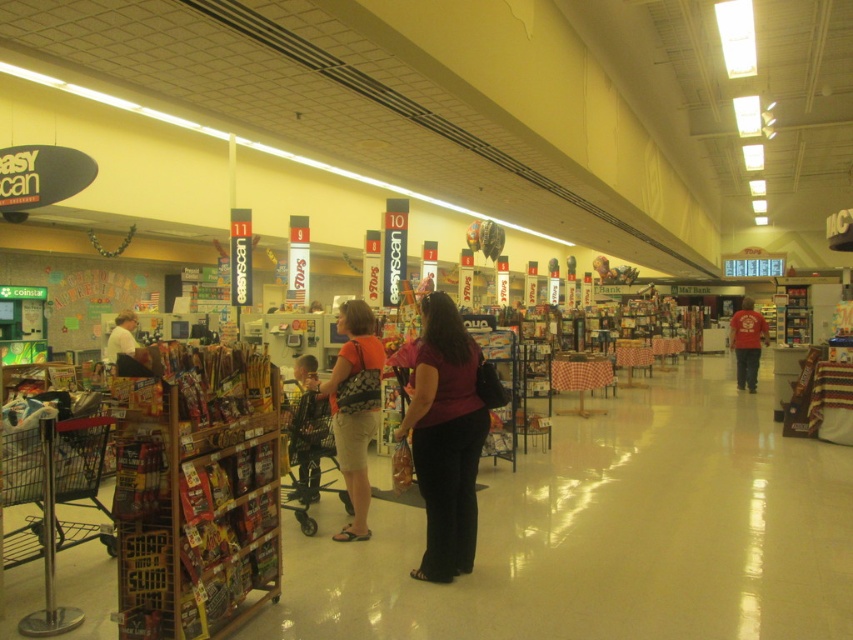
Is point (355, 422) positioned before point (747, 376)?

Yes, point (355, 422) is closer to viewer.

Who is more forward, [364,500] or [741,305]?

Point [364,500]

The height and width of the screenshot is (640, 853). Find the location of `orange fabric purse at center`. orange fabric purse at center is located at coordinates (354, 412).

Between silver metallic shopping cart at lower left and red cotton shirt at right, which one has more height?

Standing taller between the two is red cotton shirt at right.

Does silver metallic shopping cart at lower left appear on the left side of red cotton shirt at right?

Indeed, silver metallic shopping cart at lower left is positioned on the left side of red cotton shirt at right.

The height and width of the screenshot is (640, 853). Describe the element at coordinates (83, 516) in the screenshot. I see `silver metallic shopping cart at lower left` at that location.

Locate an element on the screen. This screenshot has width=853, height=640. silver metallic shopping cart at lower left is located at coordinates (83, 516).

Is maroon fabric shirt at center below metallic gray shopping cart at center?

No, maroon fabric shirt at center is not below metallic gray shopping cart at center.

Who is positioned more to the left, maroon fabric shirt at center or metallic gray shopping cart at center?

Positioned to the left is metallic gray shopping cart at center.

Where is `maroon fabric shirt at center`? The height and width of the screenshot is (640, 853). maroon fabric shirt at center is located at coordinates (445, 436).